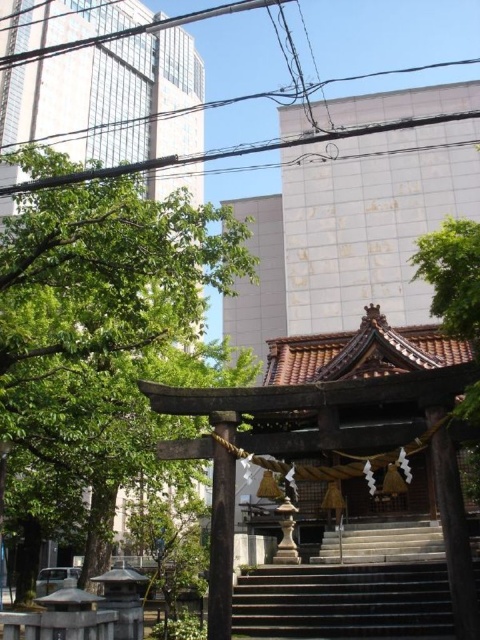
Question: Estimate the real-world distances between objects in this image. Which object is farther from the stone stairs at center?

Choices:
 (A) green leafy tree at upper left
 (B) green leafy tree at left
 (C) green leafy tree at upper right

Answer: (A)

Question: Considering the real-world distances, which object is closest to the stone stairs at center?

Choices:
 (A) green leafy tree at upper right
 (B) green leafy tree at left

Answer: (A)

Question: Does green leafy tree at upper left appear over stone stairs at center?

Choices:
 (A) yes
 (B) no

Answer: (A)

Question: Is green leafy tree at left closer to the viewer compared to green leafy tree at upper left?

Choices:
 (A) yes
 (B) no

Answer: (A)

Question: Which point appears farthest from the camera in this image?

Choices:
 (A) (422, 580)
 (B) (447, 326)
 (C) (37, 342)
 (D) (84, 17)

Answer: (D)

Question: Is green leafy tree at left in front of green leafy tree at upper left?

Choices:
 (A) no
 (B) yes

Answer: (B)